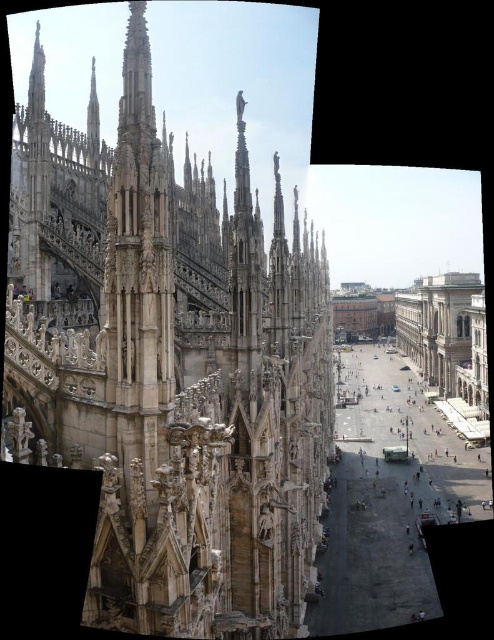
Question: Which object appears closest to the camera in this image?

Choices:
 (A) stone gothic cathedral at center
 (B) beige stone building at right

Answer: (A)

Question: Is stone gothic cathedral at center below beige stone building at right?

Choices:
 (A) no
 (B) yes

Answer: (A)

Question: Can you confirm if stone gothic cathedral at center is positioned above beige stone building at right?

Choices:
 (A) yes
 (B) no

Answer: (A)

Question: Does stone gothic cathedral at center have a lesser width compared to beige stone building at right?

Choices:
 (A) yes
 (B) no

Answer: (B)

Question: Among these points, which one is farthest from the camera?

Choices:
 (A) (263, 337)
 (B) (469, 346)

Answer: (B)

Question: Which point is closer to the camera taking this photo?

Choices:
 (A) (470, 353)
 (B) (4, 346)

Answer: (B)